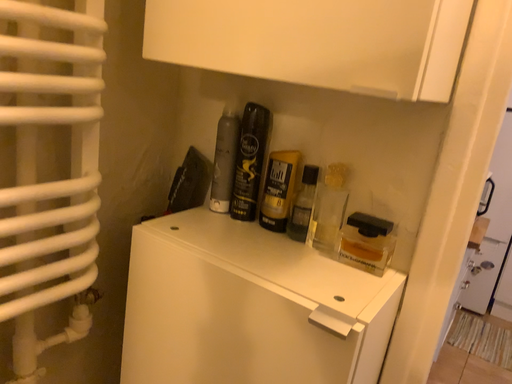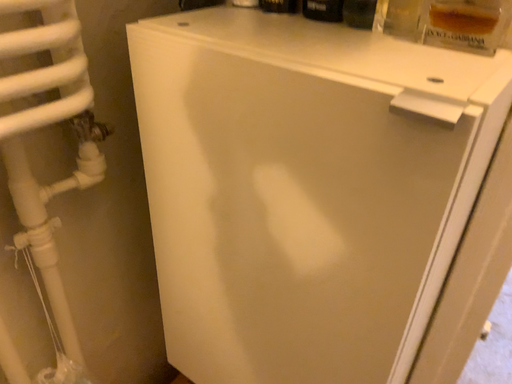
Question: Which way did the camera rotate in the video?

Choices:
 (A) rotated upward
 (B) rotated downward

Answer: (B)